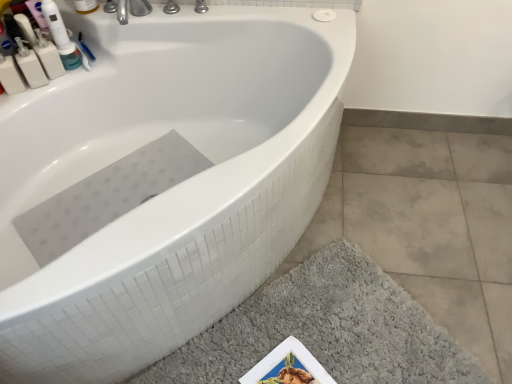
Question: Based on their positions, is white plastic bottle at upper left, which ranks as the 3th mouthwash in left-to-right order, located to the left or right of white glossy bathtub at upper center?

Choices:
 (A) left
 (B) right

Answer: (A)

Question: Relative to white glossy bathtub at upper center, is white plastic bottle at upper left, the second mouthwash from the right, in front or behind?

Choices:
 (A) front
 (B) behind

Answer: (B)

Question: Based on their relative distances, which object is farther from the gray rubber mat at lower left?

Choices:
 (A) white glossy bathtub at upper center
 (B) white plastic mouthwash at upper left, the 2th mouthwash viewed from the left
 (C) white plastic mouthwash at upper left, which is counted as the fourth mouthwash, starting from the right
 (D) white plastic mouthwash at upper left, the first mouthwash viewed from the right
 (E) white plastic bottle at upper left, the second mouthwash from the right

Answer: (D)

Question: Which object is the farthest from the gray rubber mat at lower left?

Choices:
 (A) gray shaggy bath mat at lower right
 (B) white plastic mouthwash at upper left, which appears as the third mouthwash when viewed from the right
 (C) white plastic mouthwash at upper left, the first mouthwash viewed from the right
 (D) white glossy bathtub at upper center
 (E) white plastic bottle at upper left, the second mouthwash from the right

Answer: (C)